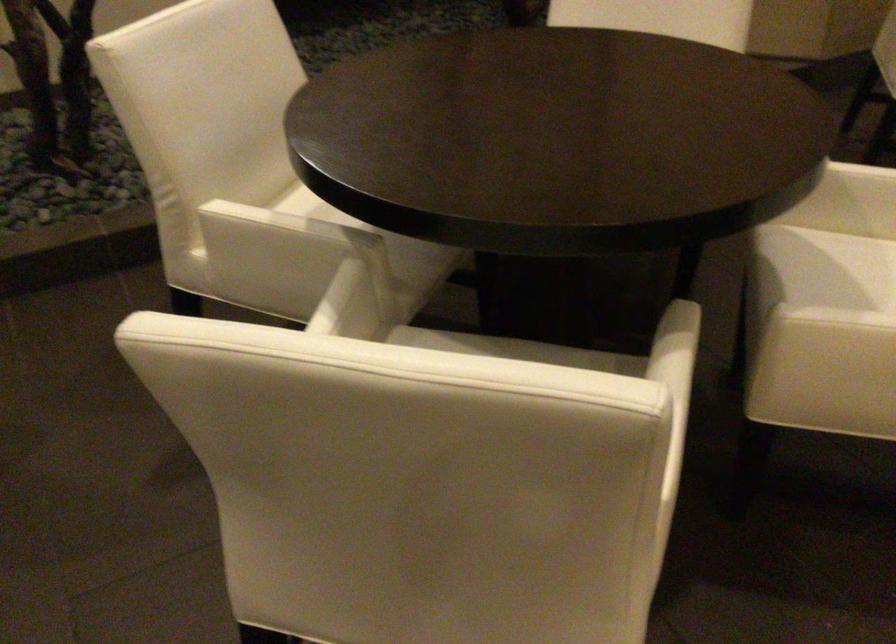
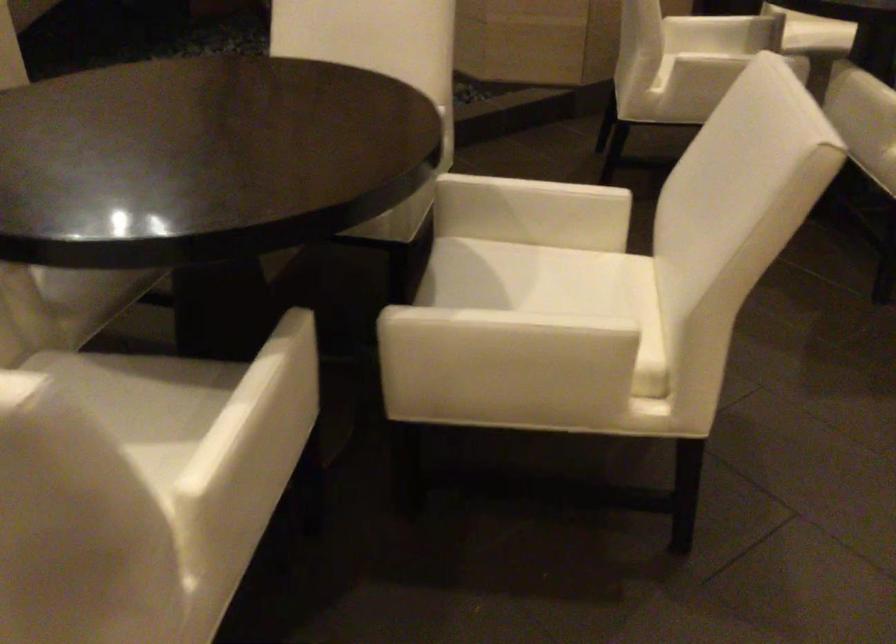
Question: The images are taken continuously from a first-person perspective. In which direction are you moving?

Choices:
 (A) Left
 (B) Right
 (C) Forward
 (D) Backward

Answer: (B)